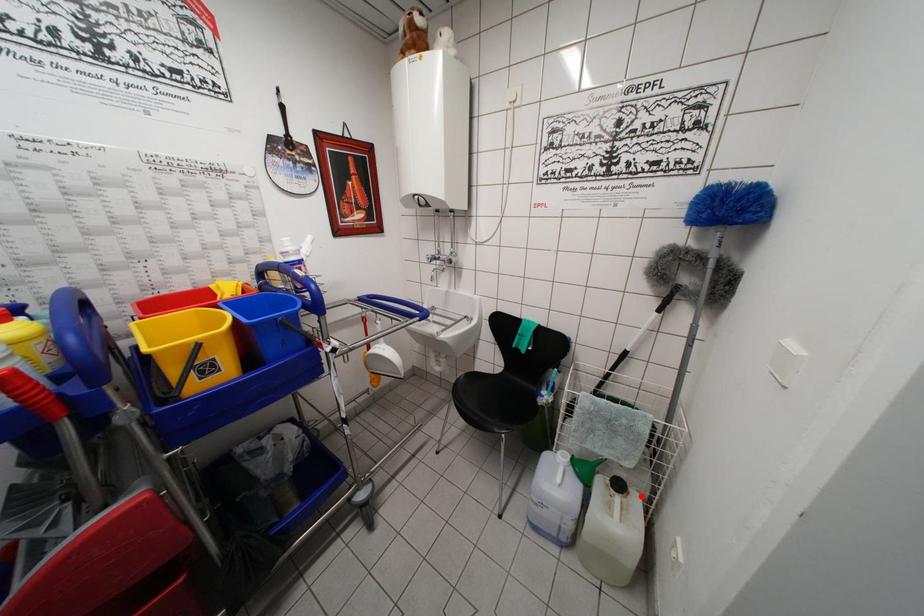
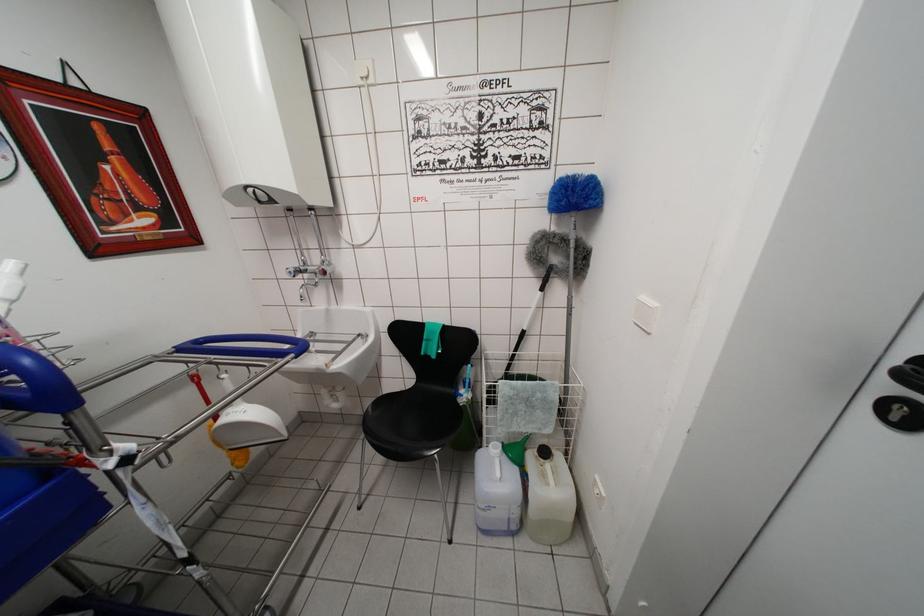
Question: I am providing you with two images of the same scene from different viewpoints. A red point is shown in image1. For the corresponding object point in image2, is it positioned nearer or farther from the camera?

Choices:
 (A) Nearer
 (B) Farther

Answer: (B)